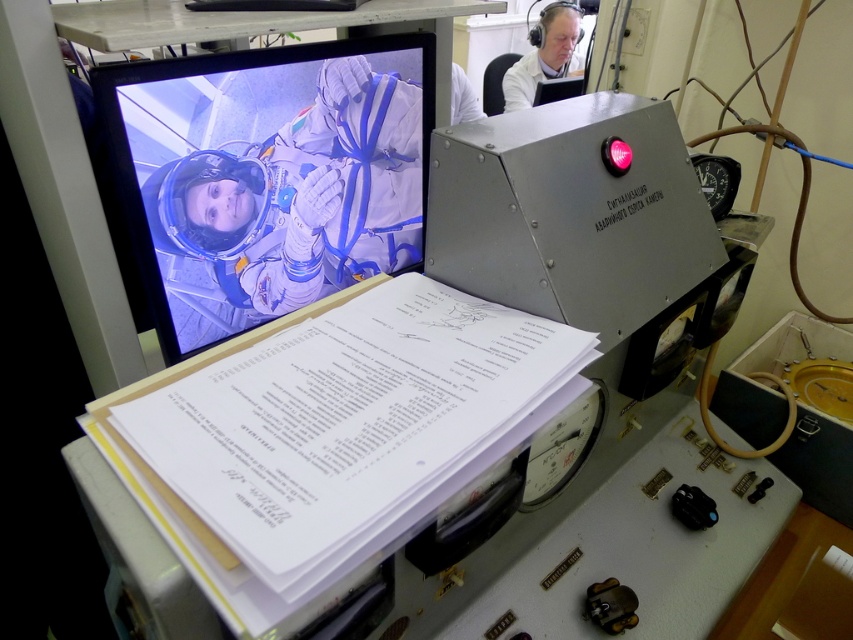
Does shiny plastic monitor at upper left have a lesser width compared to white lab coat at upper right?

In fact, shiny plastic monitor at upper left might be wider than white lab coat at upper right.

Is shiny plastic monitor at upper left to the left of white lab coat at upper right from the viewer's perspective?

Indeed, shiny plastic monitor at upper left is positioned on the left side of white lab coat at upper right.

You are a GUI agent. You are given a task and a screenshot of the screen. Output one action in this format:
    pyautogui.click(x=<x>, y=<y>)
    Task: Click on the shiny plastic monitor at upper left
    
    Given the screenshot: What is the action you would take?
    pyautogui.click(x=267, y=177)

How much distance is there between white paper at center and white lab coat at upper right?

The distance of white paper at center from white lab coat at upper right is 8.65 feet.

This screenshot has width=853, height=640. In order to click on white paper at center in this screenshot , I will do `click(339, 420)`.

I want to click on white paper at center, so click(339, 420).

Based on the photo, which is below, white paper at center or shiny plastic monitor at upper left?

white paper at center is below.

From the picture: Can you confirm if white paper at center is smaller than shiny plastic monitor at upper left?

Yes.

Between point (395, 488) and point (236, 284), which one is positioned in front?

Point (395, 488) is in front.

Image resolution: width=853 pixels, height=640 pixels. I want to click on white paper at center, so click(339, 420).